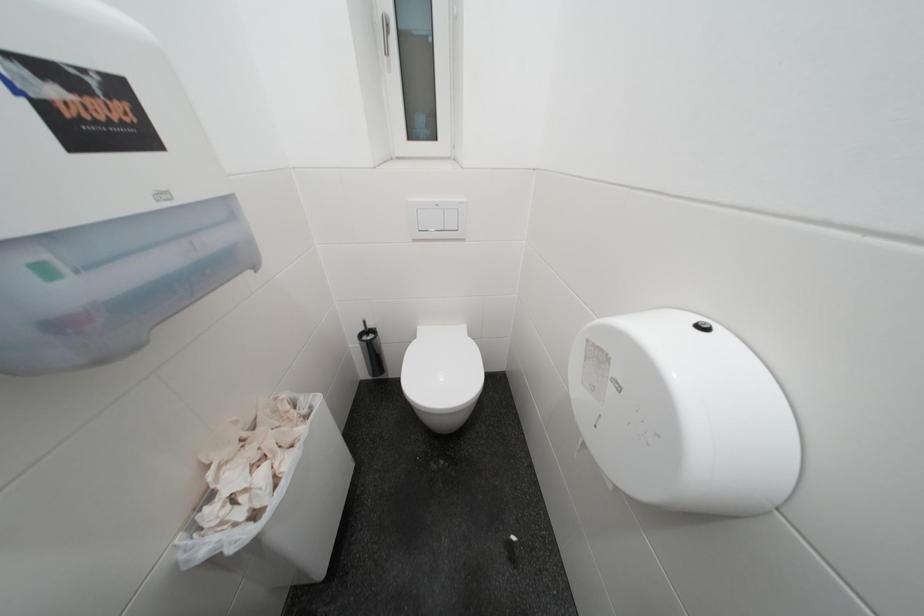
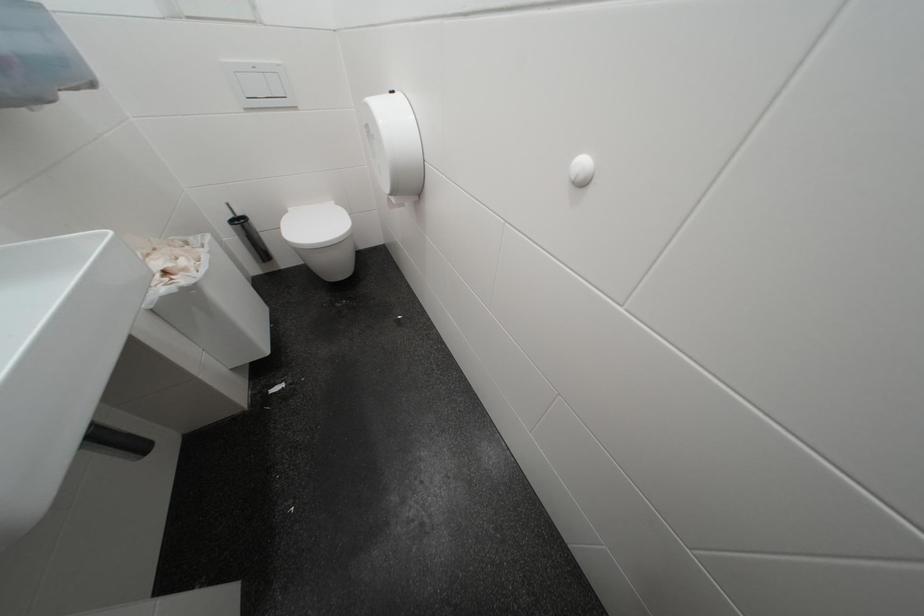
Question: In a continuous first-person perspective shot, in which direction is the camera moving?

Choices:
 (A) Left
 (B) Right
 (C) Forward
 (D) Backward

Answer: (D)